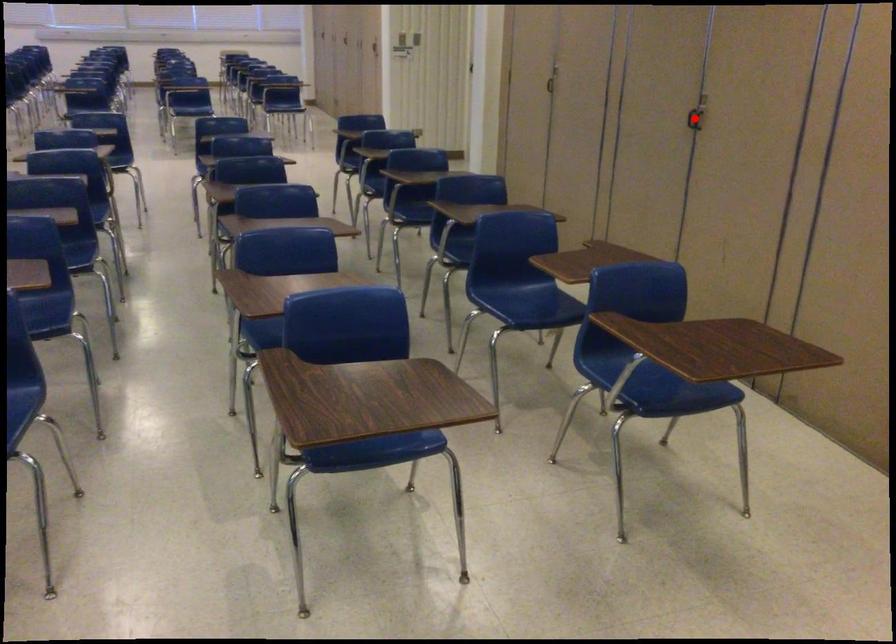
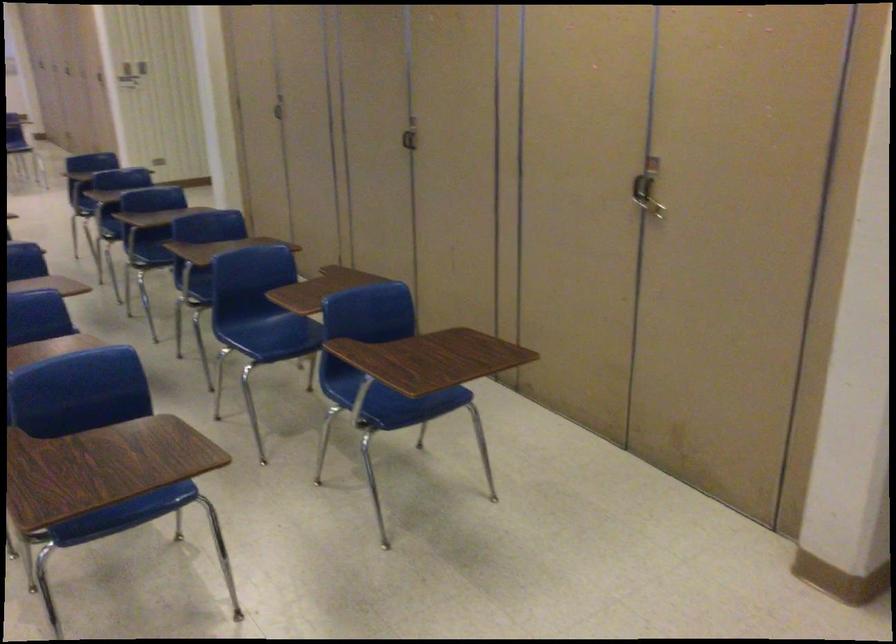
Locate, in the second image, the point that corresponds to the highlighted location in the first image.

(409, 136)